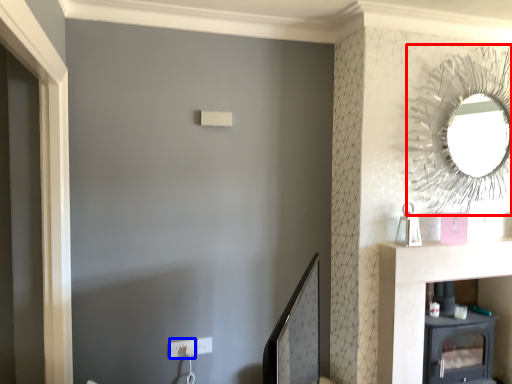
Question: Among these objects, which one is nearest to the camera, mirror (highlighted by a red box) or electric outlet (highlighted by a blue box)?

Choices:
 (A) mirror
 (B) electric outlet

Answer: (A)